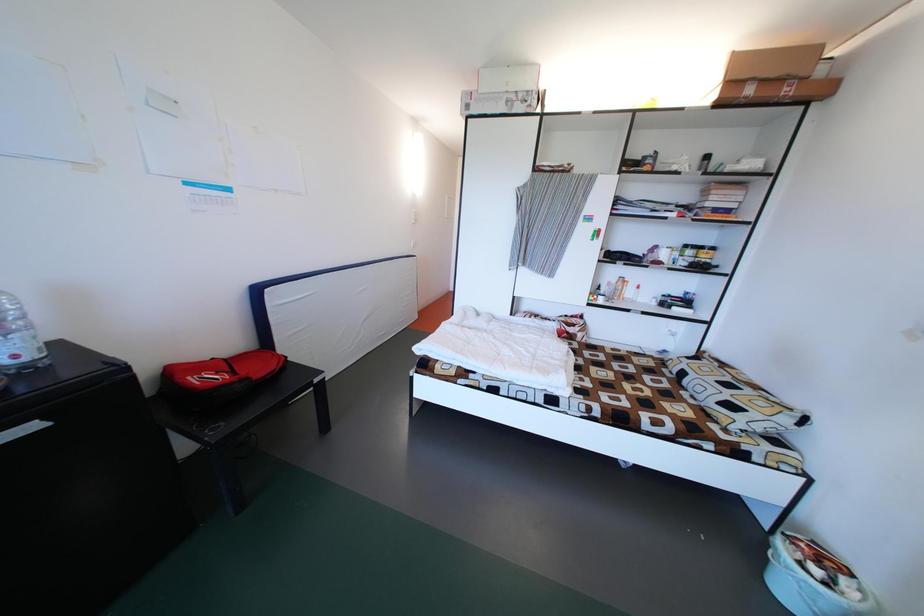
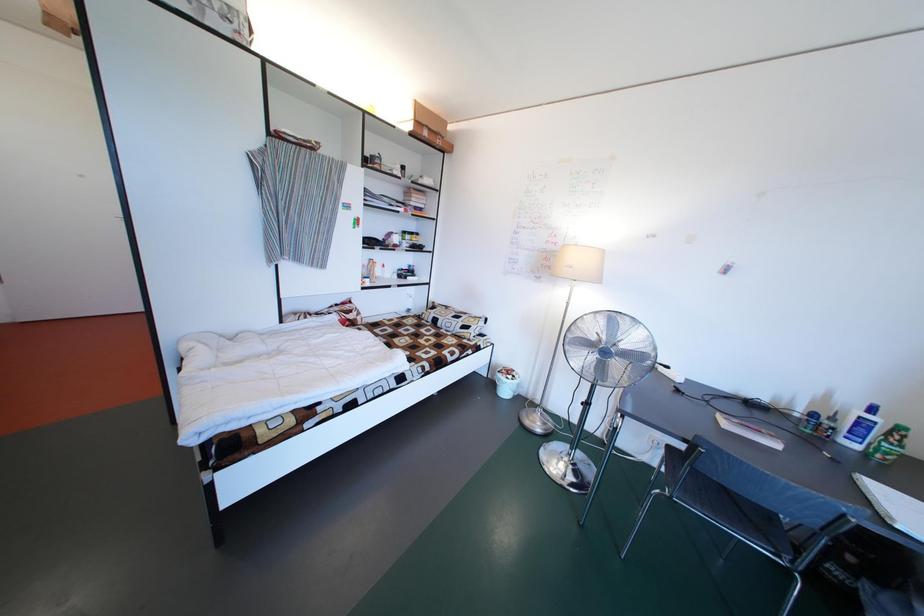
Question: The images are taken continuously from a first-person perspective. In which direction is your viewpoint rotating?

Choices:
 (A) Left
 (B) Right
 (C) Up
 (D) Down

Answer: (B)